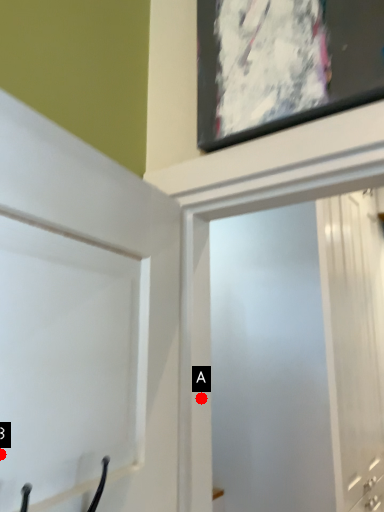
Question: Two points are circled on the image, labeled by A and B beside each circle. Which point is closer to the camera?

Choices:
 (A) A is closer
 (B) B is closer

Answer: (B)